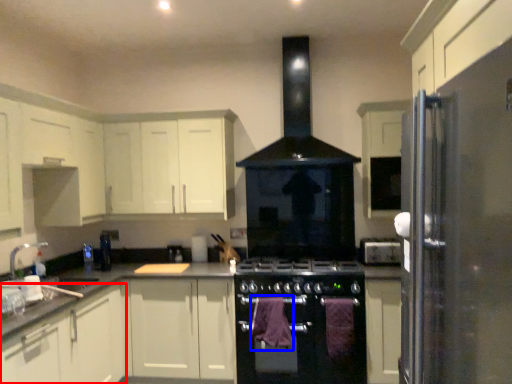
Question: Among these objects, which one is nearest to the camera, cabinetry (highlighted by a red box) or blanket (highlighted by a blue box)?

Choices:
 (A) cabinetry
 (B) blanket

Answer: (A)